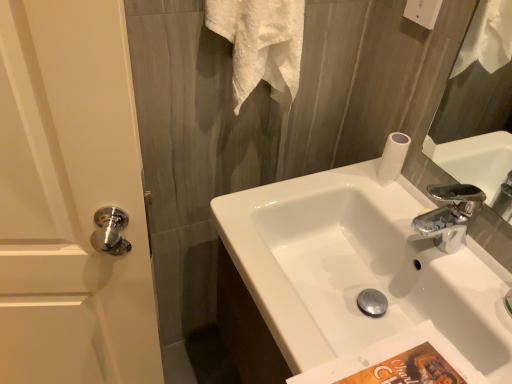
Question: From their relative heights in the image, would you say white textured towel at upper center is taller or shorter than white glossy door handle at left?

Choices:
 (A) tall
 (B) short

Answer: (B)

Question: Is white textured towel at upper center wider or thinner than white glossy door handle at left?

Choices:
 (A) thin
 (B) wide

Answer: (B)

Question: Which object is positioned farthest from the white glossy door handle at left?

Choices:
 (A) white glossy sink at center
 (B) white textured towel at upper center

Answer: (B)

Question: Which of these objects is positioned closest to the white glossy sink at center?

Choices:
 (A) white glossy door handle at left
 (B) white textured towel at upper center

Answer: (B)